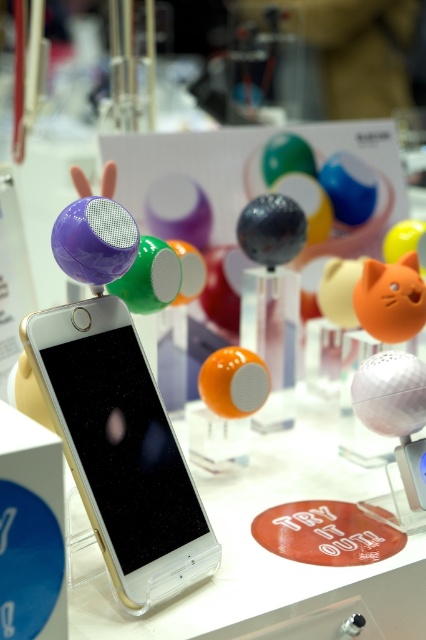
Question: Among these points, which one is nearest to the camera?

Choices:
 (A) (371, 294)
 (B) (69, 362)

Answer: (B)

Question: Does silver metallic phone at center appear on the left side of orange matte cat-shaped object at center?

Choices:
 (A) yes
 (B) no

Answer: (A)

Question: Can you confirm if silver metallic phone at center is positioned to the right of orange matte cat-shaped object at center?

Choices:
 (A) yes
 (B) no

Answer: (B)

Question: Which object is farther from the camera taking this photo?

Choices:
 (A) silver metallic phone at center
 (B) orange matte cat-shaped object at center

Answer: (B)

Question: Is silver metallic phone at center to the left of orange matte cat-shaped object at center from the viewer's perspective?

Choices:
 (A) yes
 (B) no

Answer: (A)